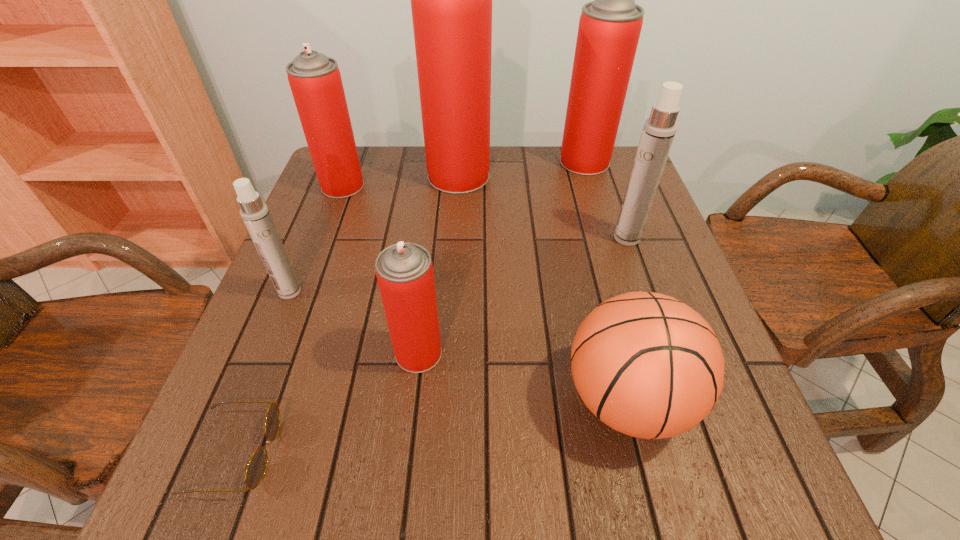
The width and height of the screenshot is (960, 540). What are the coordinates of `unoccupied position between the rightmost red aerosol can and the tallest aerosol can` in the screenshot? It's located at (521, 169).

Identify the location of vacant point located between the fifth farthest aerosol can and the third nearest aerosol can. (458, 265).

This screenshot has width=960, height=540. I want to click on vacant space that's between the seventh shortest object and the right white aerosol can, so click(606, 200).

You are a GUI agent. You are given a task and a screenshot of the screen. Output one action in this format:
    pyautogui.click(x=<x>, y=<y>)
    Task: Click on the object that stands as the sixth closest to the bigger white aerosol can
    Image resolution: width=960 pixels, height=540 pixels.
    Given the screenshot: What is the action you would take?
    pyautogui.click(x=255, y=214)

Image resolution: width=960 pixels, height=540 pixels. I want to click on object that is the closest to the third biggest red aerosol can, so click(451, 0).

This screenshot has height=540, width=960. What are the coordinates of `aerosol can that is the closest to the second tallest aerosol can` in the screenshot? It's located at (451, 0).

This screenshot has height=540, width=960. What are the coordinates of `aerosol can that is the fifth closest to the tallest aerosol can` in the screenshot? It's located at (404, 271).

This screenshot has height=540, width=960. I want to click on red aerosol can that can be found as the fourth closest to the fifth farthest object, so click(x=609, y=28).

Select which red aerosol can appears as the closest to the nearest red aerosol can. Please provide its 2D coordinates. Your answer should be formatted as a tuple, i.e. [(x, y)], where the tuple contains the x and y coordinates of a point satisfying the conditions above.

[(451, 0)]

Where is `free space that satisfies the following two spatial constraints: 1. on the front side of the nearest red aerosol can; 2. on the right side of the leftmost red aerosol can`? This screenshot has height=540, width=960. free space that satisfies the following two spatial constraints: 1. on the front side of the nearest red aerosol can; 2. on the right side of the leftmost red aerosol can is located at coordinates (280, 353).